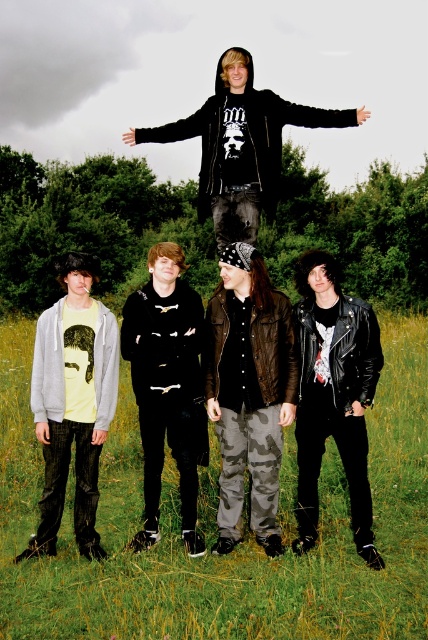
Question: Is camouflage pants at center in front of black leather jacket at center?

Choices:
 (A) no
 (B) yes

Answer: (B)

Question: Which object is the farthest from the black leather jacket at center?

Choices:
 (A) leather jacket at center
 (B) light yellow t-shirt with graphic print at lower left
 (C) green grass at lower center

Answer: (C)

Question: Is camouflage pants at center wider than leather jacket at center?

Choices:
 (A) yes
 (B) no

Answer: (A)

Question: Which point is closer to the camera taking this photo?

Choices:
 (A) (9, 348)
 (B) (348, 314)

Answer: (B)

Question: Can you confirm if leather jacket at center is positioned to the right of black matte hoodie at upper center?

Choices:
 (A) yes
 (B) no

Answer: (A)

Question: Among these objects, which one is farthest from the camera?

Choices:
 (A) black leather jacket at center
 (B) leather jacket at center
 (C) green grass at lower center

Answer: (A)